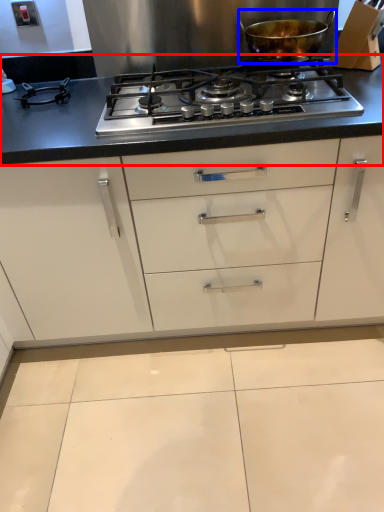
Question: Among these objects, which one is nearest to the camera, countertop (highlighted by a red box) or kitchen appliance (highlighted by a blue box)?

Choices:
 (A) countertop
 (B) kitchen appliance

Answer: (A)